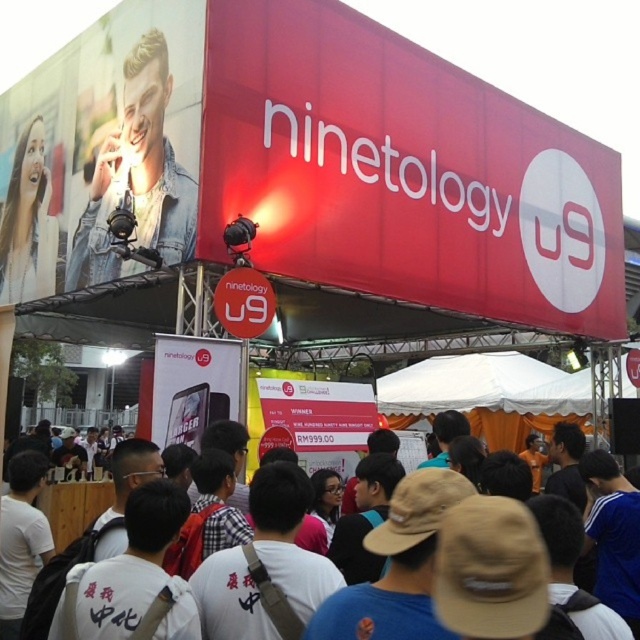
Question: Observing the image, what is the correct spatial positioning of red matte sign at upper center in reference to denim jacket at upper left?

Choices:
 (A) below
 (B) above

Answer: (B)

Question: Does red matte sign at upper center appear under denim jacket at upper left?

Choices:
 (A) no
 (B) yes

Answer: (A)

Question: Can you confirm if smooth skin face at upper left is positioned above white paper sign at center?

Choices:
 (A) no
 (B) yes

Answer: (B)

Question: Which of the following is the closest to the observer?

Choices:
 (A) red matte sign at upper center
 (B) smooth skin face at upper left
 (C) white cotton t-shirts at center

Answer: (C)

Question: Based on their relative distances, which object is farther from the matte black phone at center?

Choices:
 (A) smooth skin face at upper left
 (B) denim jacket at upper left
 (C) red matte sign at upper center

Answer: (A)

Question: Which point is closer to the camera?

Choices:
 (A) denim jacket at upper left
 (B) white cotton t-shirts at center
 (C) smooth skin face at upper left
 (D) red matte sign at upper center

Answer: (B)